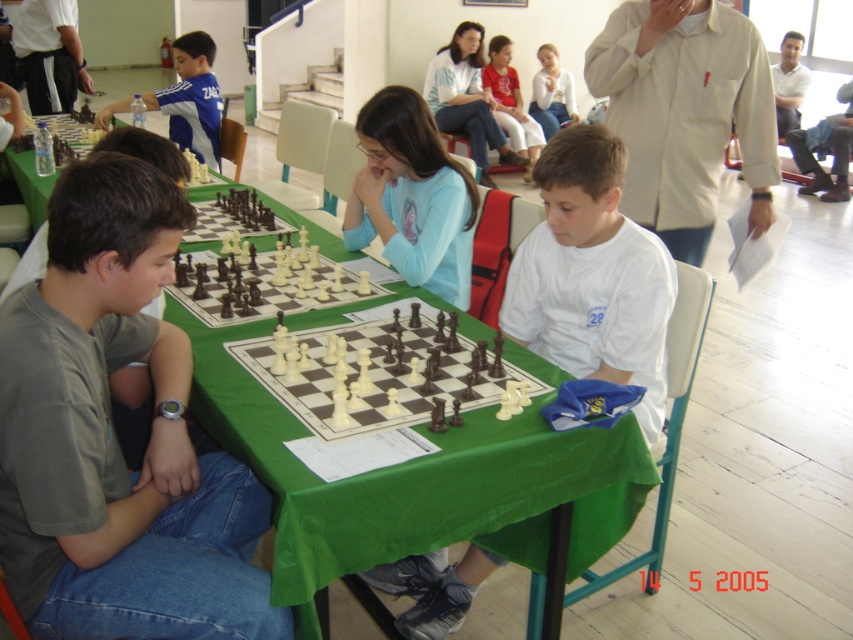
Question: Among these objects, which one is farthest from the camera?

Choices:
 (A) wooden chess set at center
 (B) matte gray shirt at left
 (C) dark wood chess set at center

Answer: (A)

Question: Observing the image, what is the correct spatial positioning of white matte shirt at center in reference to matte pink shirt at center?

Choices:
 (A) left
 (B) right

Answer: (A)

Question: Where is matte gray shirt at left located in relation to white cotton shirt at upper right in the image?

Choices:
 (A) left
 (B) right

Answer: (A)

Question: Which is nearer to the white matte shirt at center?

Choices:
 (A) dark wood chess set at center
 (B) matte pink shirt at center

Answer: (A)

Question: Is white matte shirt at center smaller than polished wood chessboard at center?

Choices:
 (A) yes
 (B) no

Answer: (A)

Question: Which object appears farthest from the camera in this image?

Choices:
 (A) light blue sweater at upper center
 (B) white matte shirt at center
 (C) polished wood chessboard at center
 (D) dark wood chess set at center

Answer: (A)